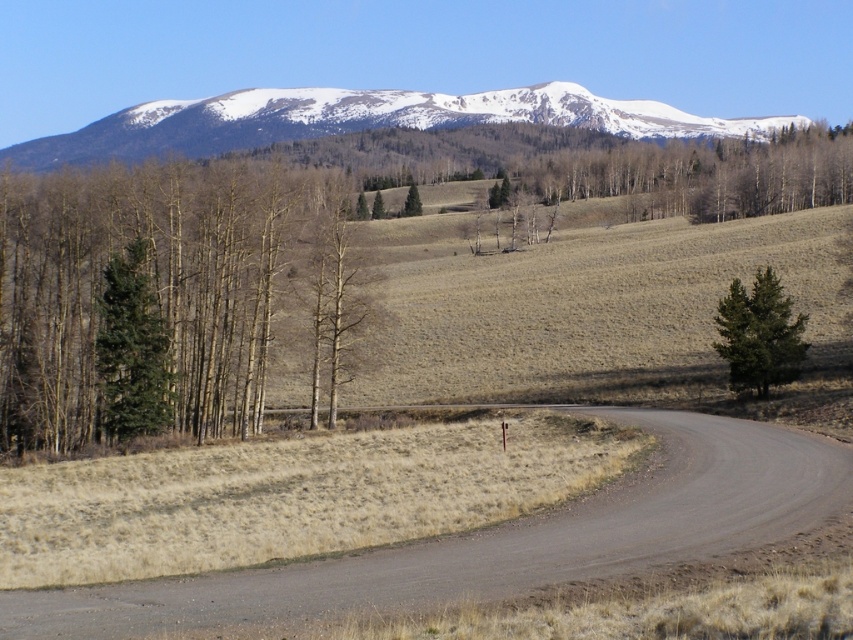
You are standing at the origin point of the coordinate system in the image. You want to walk towards the green matte tree at left. What direction should you head in?

The green matte tree at left is located at coordinate point 0.466 on the x axis and 0.172 on the y axis. Since the origin is at the bottom left corner of the image, you should head northeast to reach the green matte tree at left.

You are planning a hiking trip and need to decide whether to take the winding dirt road through the foreground. You notice the snowy mountain at upper center and the green textured tree at right. Based on their sizes, which one would be closer to you?

The snowy mountain at upper center is larger in size than the green textured tree at right. Since larger objects in the distance can appear smaller, but in this case, the mountain is larger, it might actually be closer. Wait, but mountains are naturally larger. Hmm, maybe the question is about perspective? If the mountain is larger in the scene, it could mean it is closer. But I need to recall that in perspective, closer objects appear larger. So if the mountain is depicted as larger than the tree, it is in

You are standing at the center of the winding dirt road in the foreground. You notice the green matte evergreen tree at left. Based on its position, can you determine if the tree is closer to the road or further away from it?

The green matte evergreen tree at left is located at point coordinates that place it closer to the road compared to the surrounding terrain, so it is closer to the road.